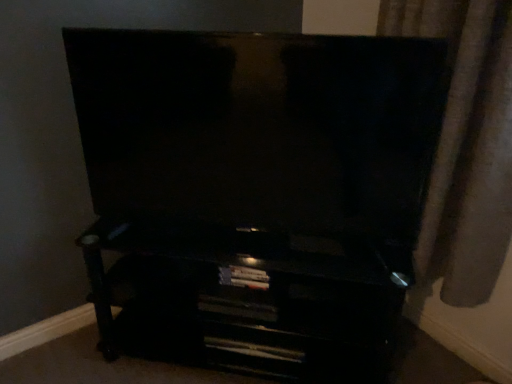
Identify the location of vacant region below matte black tv at center (from a real-world perspective). The width and height of the screenshot is (512, 384). (252, 245).